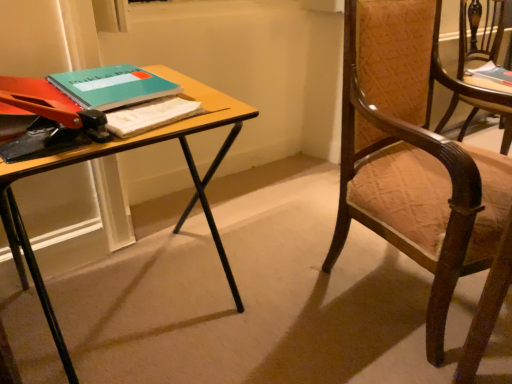
At what (x,y) coordinates should I click in order to perform the action: click on free point above teal matte book at upper right, the 1th book positioned from the back (from a real-world perspective). Please return your answer as a coordinate pair (x, y). Image resolution: width=512 pixels, height=384 pixels. Looking at the image, I should click on (492, 72).